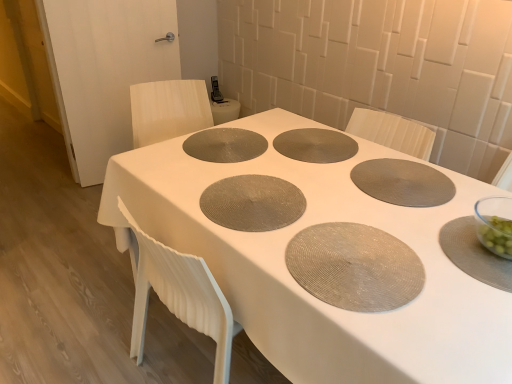
At what (x,y) coordinates should I click in order to perform the action: click on free space above matte gray placemat at center, arranged as the first oval when ordered from the bottom (from a real-world perspective). Please return your answer as a coordinate pair (x, y). Image resolution: width=512 pixels, height=384 pixels. Looking at the image, I should click on (349, 251).